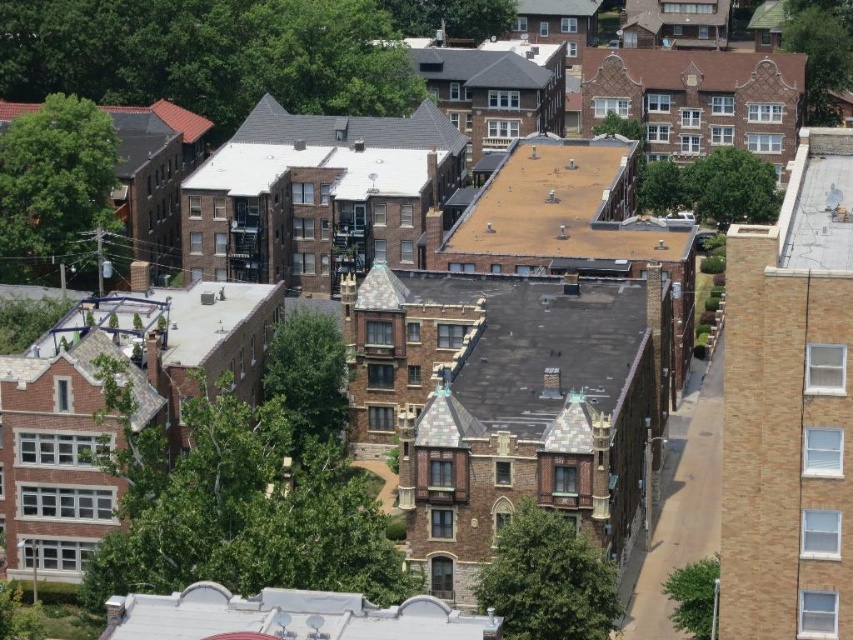
Between point (305, 616) and point (608, 72), which one is positioned behind?

Point (608, 72)

From the picture: Can you confirm if white matte roof at lower center is smaller than brown shingles at upper right?

No, white matte roof at lower center is not smaller than brown shingles at upper right.

Describe the element at coordinates (287, 616) in the screenshot. I see `white matte roof at lower center` at that location.

Where is `white matte roof at lower center`? white matte roof at lower center is located at coordinates pos(287,616).

Between brown shingles at center and white matte roof at lower center, which one is positioned higher?

Positioned higher is brown shingles at center.

Does brown shingles at center lie behind white matte roof at lower center?

Yes, it is behind white matte roof at lower center.

Which is behind, point (532, 244) or point (171, 637)?

The point (532, 244) is more distant.

At what (x,y) coordinates should I click in order to perform the action: click on brown shingles at center. Please return your answer as a coordinate pair (x, y). Looking at the image, I should click on (560, 212).

Which is above, brown shingles at center or brown shingles at upper right?

brown shingles at upper right

Can you confirm if brown shingles at center is smaller than brown shingles at upper right?

No.

Who is more forward, (567, 237) or (614, 72)?

Point (567, 237) is more forward.

Where is `brown shingles at center`? brown shingles at center is located at coordinates (560, 212).